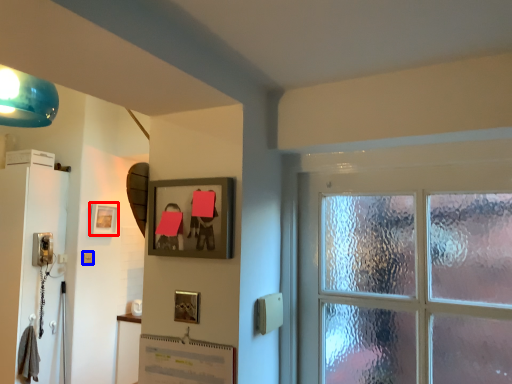
Question: Which object appears farthest to the camera in this image, picture frame (highlighted by a red box) or light switch (highlighted by a blue box)?

Choices:
 (A) picture frame
 (B) light switch

Answer: (A)